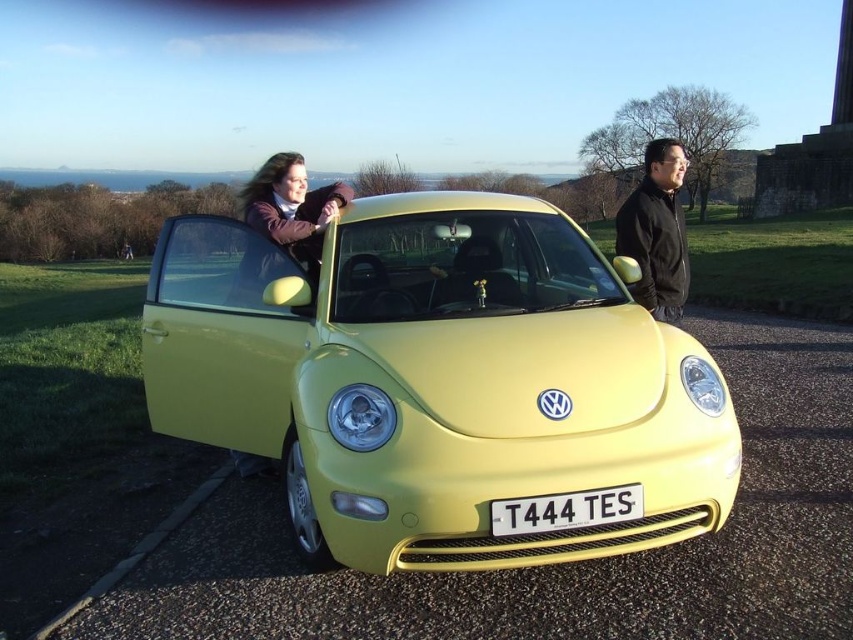
Is matte purple jacket at upper left to the left of white plastic license plate at center from the viewer's perspective?

Correct, you'll find matte purple jacket at upper left to the left of white plastic license plate at center.

Can you confirm if matte purple jacket at upper left is wider than white plastic license plate at center?

Indeed, matte purple jacket at upper left has a greater width compared to white plastic license plate at center.

You are a GUI agent. You are given a task and a screenshot of the screen. Output one action in this format:
    pyautogui.click(x=<x>, y=<y>)
    Task: Click on the matte purple jacket at upper left
    
    Given the screenshot: What is the action you would take?
    pyautogui.click(x=292, y=209)

Image resolution: width=853 pixels, height=640 pixels. In order to click on lime matte car at center in this screenshot , I will do `click(437, 380)`.

Between lime matte car at center and white plastic license plate at center, which one appears on the left side from the viewer's perspective?

From the viewer's perspective, lime matte car at center appears more on the left side.

Is point (280, 344) farther from viewer compared to point (564, 513)?

Yes, point (280, 344) is farther from viewer.

Identify the location of lime matte car at center. click(437, 380).

Which is more to the left, black matte jacket at right or white plastic license plate at center?

From the viewer's perspective, white plastic license plate at center appears more on the left side.

Find the location of a particular element. The width and height of the screenshot is (853, 640). black matte jacket at right is located at coordinates (656, 230).